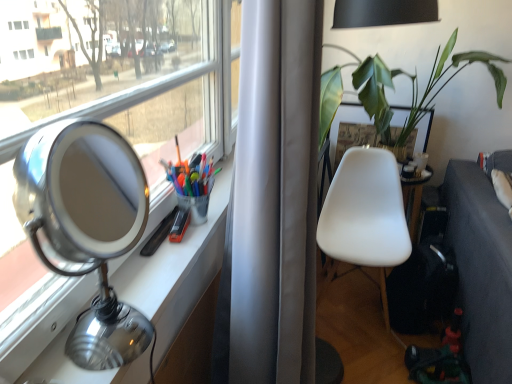
Question: Is green leafy plant at upper right at the right side of dark gray fabric couch at lower right?

Choices:
 (A) yes
 (B) no

Answer: (B)

Question: From a real-world perspective, is green leafy plant at upper right beneath dark gray fabric couch at lower right?

Choices:
 (A) no
 (B) yes

Answer: (A)

Question: Is green leafy plant at upper right in contact with dark gray fabric couch at lower right?

Choices:
 (A) yes
 (B) no

Answer: (B)

Question: From the image's perspective, would you say green leafy plant at upper right is shown under dark gray fabric couch at lower right?

Choices:
 (A) yes
 (B) no

Answer: (B)

Question: Considering the relative sizes of green leafy plant at upper right and dark gray fabric couch at lower right in the image provided, is green leafy plant at upper right smaller than dark gray fabric couch at lower right?

Choices:
 (A) yes
 (B) no

Answer: (A)

Question: From the image's perspective, is dark gray fabric couch at lower right above or below green leafy plant at upper right?

Choices:
 (A) below
 (B) above

Answer: (A)

Question: From a real-world perspective, is dark gray fabric couch at lower right above or below green leafy plant at upper right?

Choices:
 (A) above
 (B) below

Answer: (B)

Question: Considering the positions of point (462, 314) and point (487, 64), is point (462, 314) closer or farther from the camera than point (487, 64)?

Choices:
 (A) farther
 (B) closer

Answer: (B)

Question: Looking at their shapes, would you say dark gray fabric couch at lower right is wider or thinner than green leafy plant at upper right?

Choices:
 (A) thin
 (B) wide

Answer: (A)

Question: Considering the positions of polished silver table lamp at left and green leafy plant at upper right in the image, is polished silver table lamp at left wider or thinner than green leafy plant at upper right?

Choices:
 (A) thin
 (B) wide

Answer: (A)

Question: Relative to green leafy plant at upper right, is polished silver table lamp at left in front or behind?

Choices:
 (A) front
 (B) behind

Answer: (A)

Question: From a real-world perspective, is polished silver table lamp at left above or below green leafy plant at upper right?

Choices:
 (A) below
 (B) above

Answer: (B)

Question: Considering the positions of point (129, 215) and point (446, 64), is point (129, 215) closer or farther from the camera than point (446, 64)?

Choices:
 (A) closer
 (B) farther

Answer: (A)

Question: Would you say white matte chair at center is inside or outside dark gray fabric couch at lower right?

Choices:
 (A) outside
 (B) inside

Answer: (A)

Question: From a real-world perspective, is white matte chair at center above or below dark gray fabric couch at lower right?

Choices:
 (A) below
 (B) above

Answer: (B)